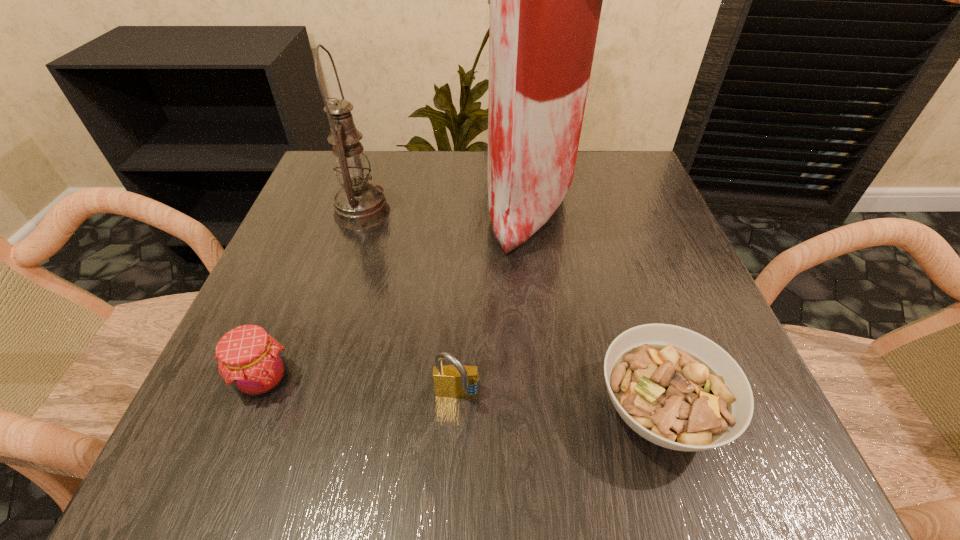
The image size is (960, 540). Find the location of `free space at the far edge of the desktop`. free space at the far edge of the desktop is located at coordinates (455, 184).

In the image, there is a desktop. Where is `vacant region at the near edge`? vacant region at the near edge is located at coordinates (369, 437).

In the image, there is a desktop. In order to click on vacant space at the left edge in this screenshot , I will do (x=337, y=315).

At what (x,y) coordinates should I click in order to perform the action: click on free space at the right edge. Please return your answer as a coordinate pair (x, y). The height and width of the screenshot is (540, 960). Looking at the image, I should click on (618, 225).

In the image, there is a desktop. Where is `vacant space at the near left corner`? This screenshot has height=540, width=960. vacant space at the near left corner is located at coordinates (299, 434).

Find the location of `free region at the far right corner`. free region at the far right corner is located at coordinates (604, 156).

Image resolution: width=960 pixels, height=540 pixels. Identify the location of vacant space at the near right corner of the desktop. (776, 437).

I want to click on free space between the oil lamp and the third shortest object, so click(x=410, y=305).

Locate an element on the screen. The height and width of the screenshot is (540, 960). vacant region between the stew and the third tallest object is located at coordinates (559, 404).

The height and width of the screenshot is (540, 960). Identify the location of free space between the jam and the grocery bag. (396, 291).